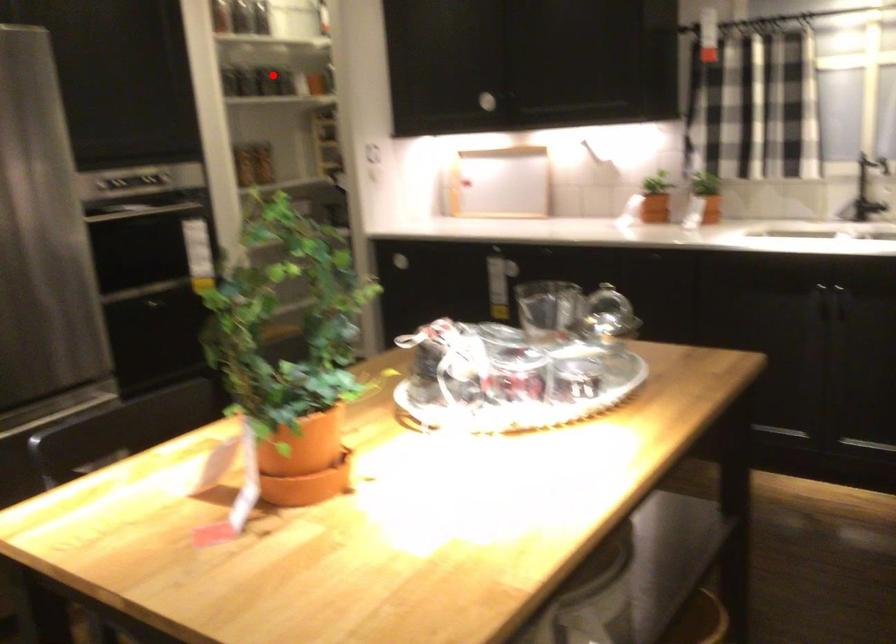
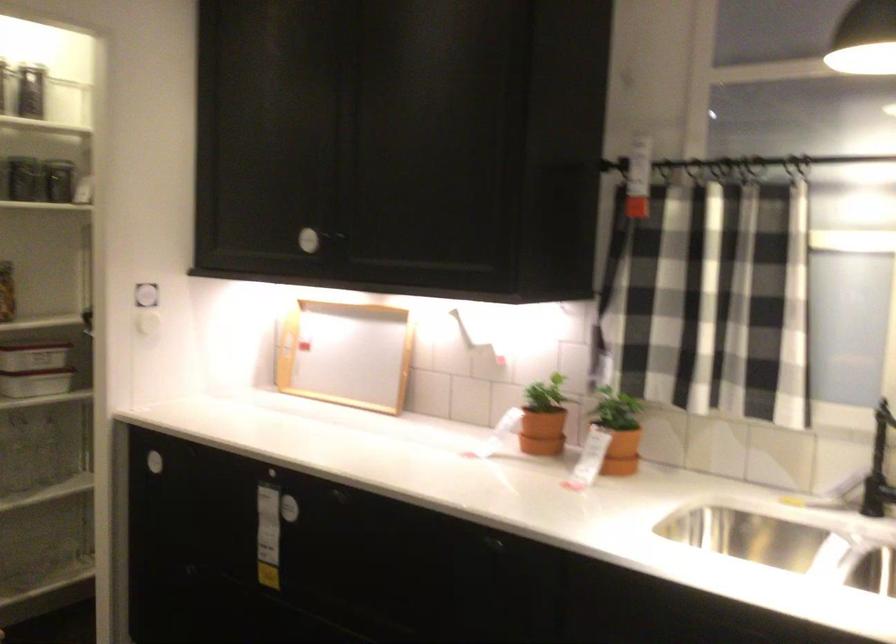
In the second image, find the point that corresponds to the highlighted location in the first image.

(31, 187)